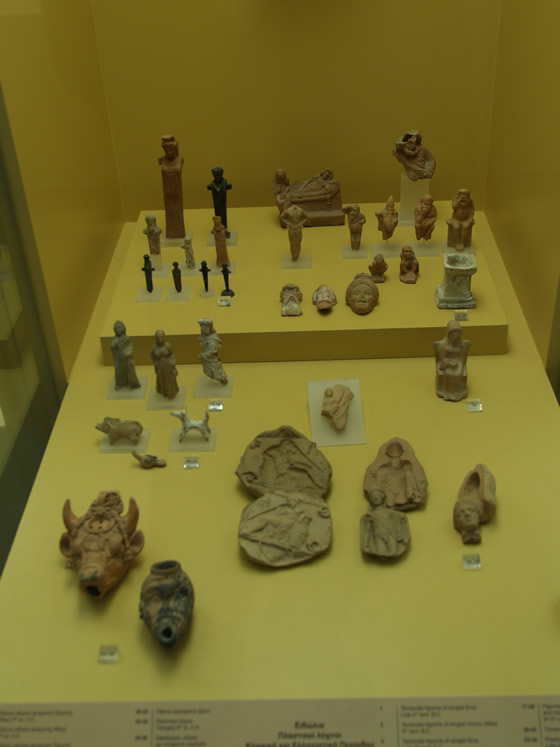
Locate an element on the screen. wall is located at coordinates (468, 75), (64, 267).